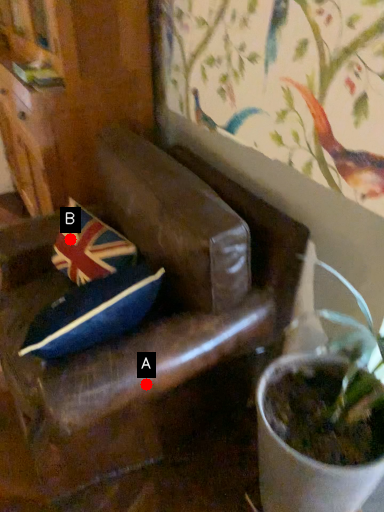
Question: Two points are circled on the image, labeled by A and B beside each circle. Which of the following is the closest to the observer?

Choices:
 (A) A is closer
 (B) B is closer

Answer: (A)